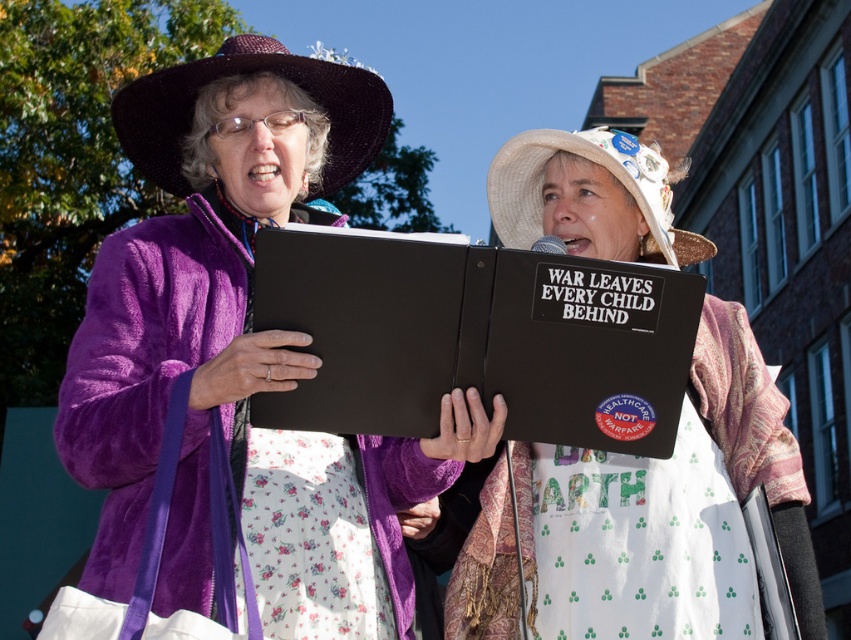
Question: Among these points, which one is farthest from the camera?

Choices:
 (A) (121, 508)
 (B) (627, 483)

Answer: (B)

Question: Is purple velvety jacket at center to the right of white fabric apron at center from the viewer's perspective?

Choices:
 (A) yes
 (B) no

Answer: (B)

Question: Does purple velvety jacket at center have a greater width compared to white fabric apron at center?

Choices:
 (A) no
 (B) yes

Answer: (B)

Question: Is purple velvety jacket at center smaller than white fabric apron at center?

Choices:
 (A) no
 (B) yes

Answer: (A)

Question: Which point is closer to the camera?

Choices:
 (A) (578, 134)
 (B) (261, 544)

Answer: (B)

Question: Which point is closer to the camera?

Choices:
 (A) purple velvety jacket at center
 (B) white fabric apron at center

Answer: (A)